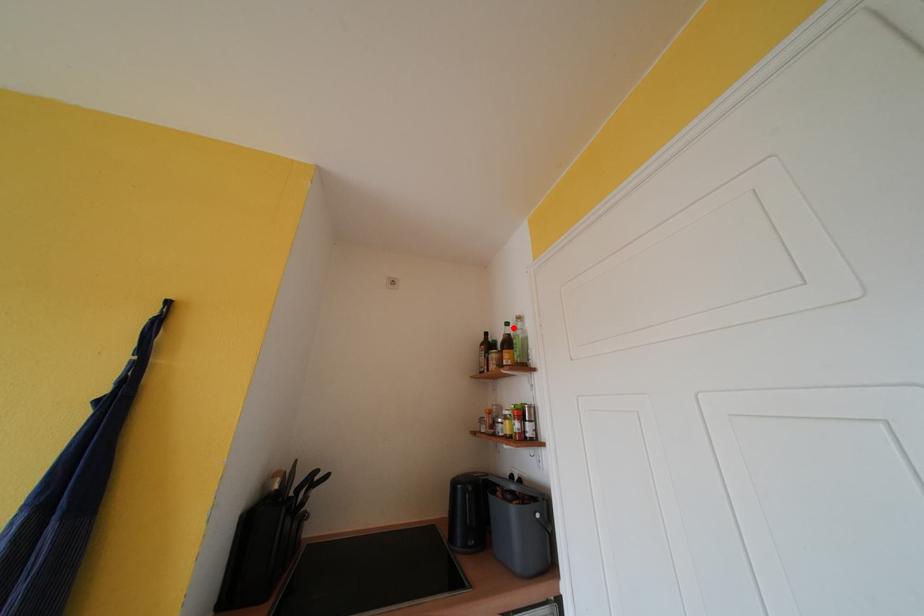
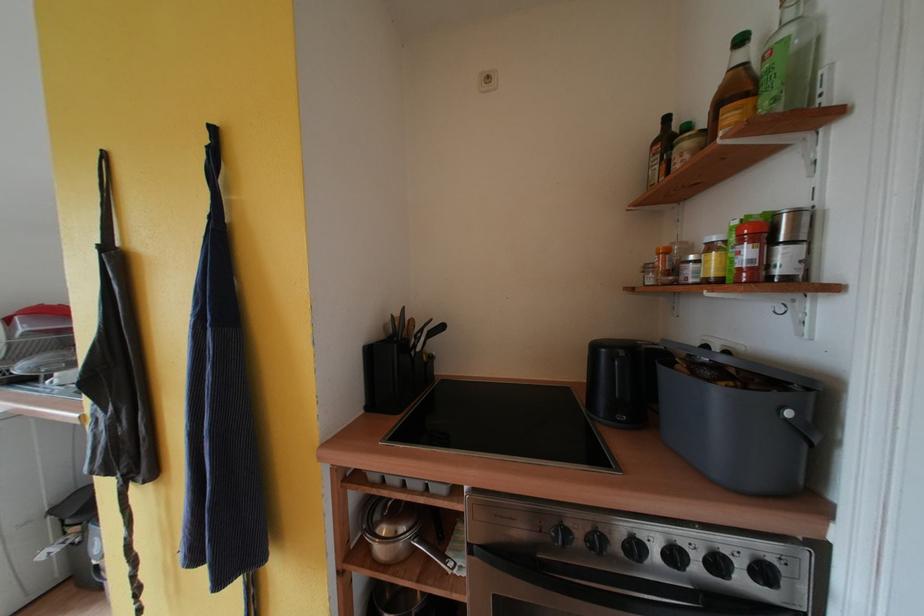
Locate, in the second image, the point that corresponds to the highlighted location in the first image.

(748, 44)